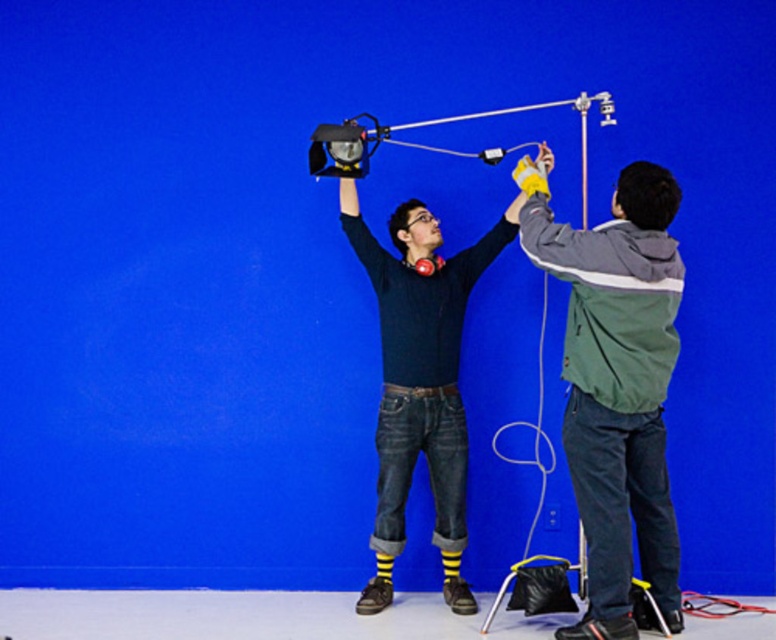
You are a photographer trying to position a green fabric jacket at right in a photo shoot. The jacket is represented by point (615, 385). What are the coordinates of the point representing the green fabric jacket at right?

The coordinates of the point representing the green fabric jacket at right are (615, 385).

You are a photographer trying to position two subjects for a photo shoot. You have a green fabric jacket at right and a dark blue sweater at center. Which clothing item should you adjust to ensure both are visible in the frame, considering their height?

The green fabric jacket at right is not as tall as the dark blue sweater at center, so you should adjust the green fabric jacket at right to ensure it is positioned where it can be seen properly.

From the picture: You are a photographer trying to set up a chroma key background. You need to adjust the lighting so that the subject wearing the green fabric jacket at right and the dark blue sweater at center are both well lit. Which subject should you adjust the light closer to first?

The green fabric jacket at right is positioned under dark blue sweater at center, so you should adjust the light closer to the green fabric jacket at right first to ensure it receives adequate lighting.